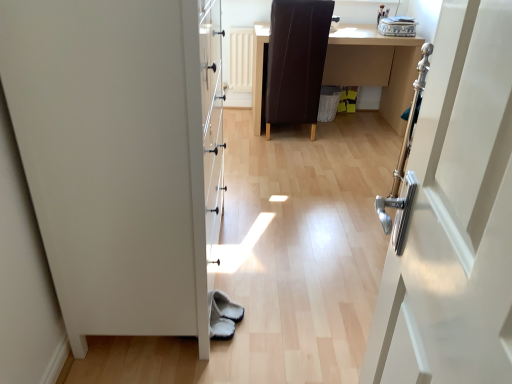
The height and width of the screenshot is (384, 512). In order to click on brown leather chair at center in this screenshot , I will do `click(295, 61)`.

Locate an element on the screen. white matte door at left is located at coordinates (115, 158).

Measure the distance between brown leather desk at center and brown leather chair at center.

brown leather desk at center and brown leather chair at center are 18.49 inches apart from each other.

From a real-world perspective, does brown leather desk at center stand above brown leather chair at center?

No, from a real-world perspective, brown leather desk at center is not above brown leather chair at center.

Is brown leather desk at center not close to brown leather chair at center?

brown leather desk at center is near brown leather chair at center, not far away.

Is brown leather desk at center positioned with its back to brown leather chair at center?

That's right, brown leather desk at center is facing away from brown leather chair at center.

Which of these two, white matte door at left or brown leather desk at center, stands taller?

white matte door at left is taller.

Considering the relative sizes of white matte door at left and brown leather desk at center in the image provided, is white matte door at left wider than brown leather desk at center?

No, white matte door at left is not wider than brown leather desk at center.

Looking at the image, does white matte door at left seem bigger or smaller compared to brown leather desk at center?

In the image, white matte door at left appears to be larger than brown leather desk at center.

Is white matte door at left to the left or to the right of brown leather desk at center in the image?

Based on their positions, white matte door at left is located to the left of brown leather desk at center.

Considering the relative positions of brown leather desk at center and white matte door at left in the image provided, is brown leather desk at center to the right of white matte door at left from the viewer's perspective?

Indeed, brown leather desk at center is positioned on the right side of white matte door at left.

From the image's perspective, is brown leather desk at center above white matte door at left?

Indeed, from the image's perspective, brown leather desk at center is shown above white matte door at left.

Who is bigger, brown leather desk at center or white matte door at left?

Bigger between the two is white matte door at left.

Does white matte door at left touch brown leather chair at center?

No, white matte door at left is not with brown leather chair at center.

Is white matte door at left further to camera compared to brown leather chair at center?

No, white matte door at left is closer to the viewer.

Considering the sizes of objects white matte door at left and brown leather chair at center in the image provided, who is shorter, white matte door at left or brown leather chair at center?

brown leather chair at center is shorter.

Find the location of `chair above the white matte door at left (from the image's perspective)`. chair above the white matte door at left (from the image's perspective) is located at coordinates (295, 61).

Which is more to the right, brown leather chair at center or brown leather desk at center?

brown leather desk at center is more to the right.

Which of these two, brown leather chair at center or brown leather desk at center, stands taller?

brown leather chair at center is taller.

Is brown leather chair at center in front of brown leather desk at center?

Yes, brown leather chair at center is closer to the camera.

Is brown leather chair at center situated inside brown leather desk at center or outside?

brown leather chair at center is enclosed within brown leather desk at center.

Looking at the image, does brown leather chair at center seem bigger or smaller compared to white matte door at left?

Considering their sizes, brown leather chair at center takes up less space than white matte door at left.

Which object is positioned more to the left, brown leather chair at center or white matte door at left?

Positioned to the left is white matte door at left.

Locate an element on the screen. The image size is (512, 384). chair above the white matte door at left (from the image's perspective) is located at coordinates (295, 61).

Can you see brown leather chair at center touching white matte door at left?

No, brown leather chair at center is not making contact with white matte door at left.

At what (x,y) coordinates should I click in order to perform the action: click on table beneath the brown leather chair at center (from a real-world perspective). Please return your answer as a coordinate pair (x, y). Looking at the image, I should click on (374, 66).

Locate an element on the screen. Image resolution: width=512 pixels, height=384 pixels. table that appears above the white matte door at left (from the image's perspective) is located at coordinates (374, 66).

When comparing their distances from brown leather desk at center, does white matte door at left or brown leather chair at center seem closer?

brown leather chair at center lies closer to brown leather desk at center than the other object.

When comparing their distances from brown leather chair at center, does white matte door at left or brown leather desk at center seem closer?

brown leather desk at center is closer to brown leather chair at center.

Considering their positions, is brown leather desk at center positioned further to brown leather chair at center than white matte door at left?

white matte door at left.

Which object lies nearer to the anchor point white matte door at left, brown leather chair at center or brown leather desk at center?

The object closer to white matte door at left is brown leather chair at center.

From the image, which object appears to be nearer to white matte door at left, brown leather desk at center or brown leather chair at center?

brown leather chair at center is closer to white matte door at left.

Estimate the real-world distances between objects in this image. Which object is closer to brown leather desk at center, brown leather chair at center or white matte door at left?

brown leather chair at center lies closer to brown leather desk at center than the other object.

The image size is (512, 384). Identify the location of chair positioned between white matte door at left and brown leather desk at center from near to far. [x=295, y=61].